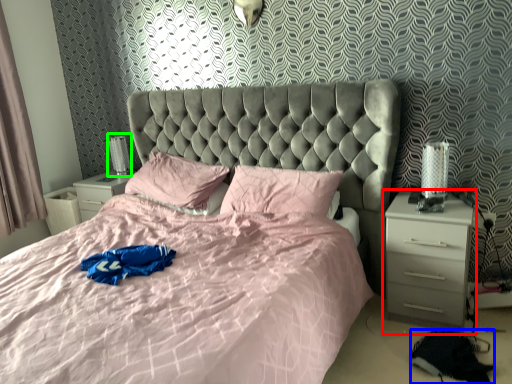
Question: Estimate the real-world distances between objects in this image. Which object is closer to nightstand (highlighted by a red box), material (highlighted by a blue box) or table lamp (highlighted by a green box)?

Choices:
 (A) material
 (B) table lamp

Answer: (A)